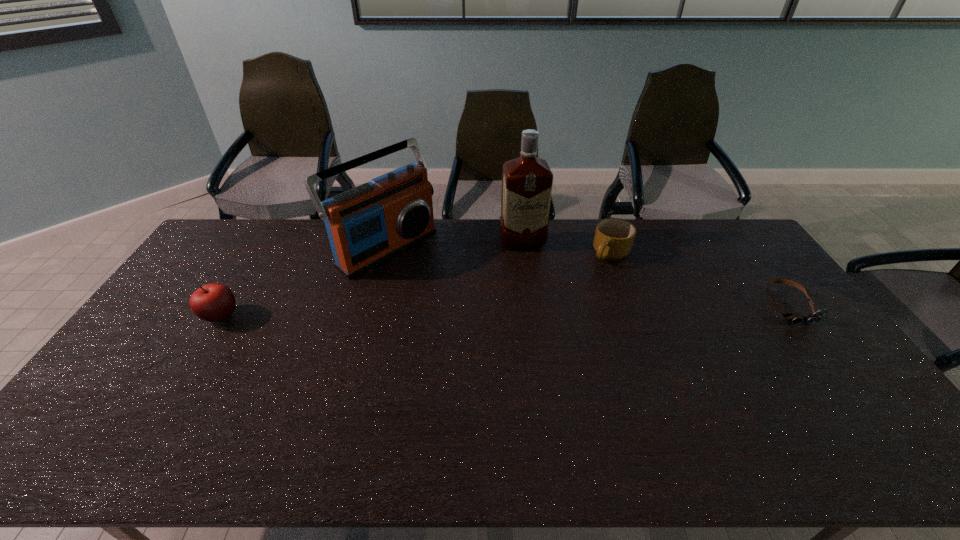
I want to click on radio receiver present at the far edge, so click(373, 222).

Identify the location of mug located in the far edge section of the desktop. coord(613,238).

At what (x,y) coordinates should I click in order to perform the action: click on liquor at the far edge. Please return your answer as a coordinate pair (x, y). Image resolution: width=960 pixels, height=540 pixels. Looking at the image, I should click on (527, 181).

Image resolution: width=960 pixels, height=540 pixels. In order to click on object at the left edge in this screenshot , I will do `click(214, 302)`.

Where is `object that is at the right edge`? This screenshot has height=540, width=960. object that is at the right edge is located at coordinates (815, 317).

Locate an element on the screen. The width and height of the screenshot is (960, 540). free region at the far edge of the desktop is located at coordinates (449, 223).

At what (x,y) coordinates should I click in order to perform the action: click on vacant region at the near edge. Please return your answer as a coordinate pair (x, y). This screenshot has height=540, width=960. Looking at the image, I should click on (636, 418).

Locate an element on the screen. The height and width of the screenshot is (540, 960). vacant area at the left edge is located at coordinates (225, 260).

Locate an element on the screen. Image resolution: width=960 pixels, height=540 pixels. vacant space at the right edge is located at coordinates (773, 324).

Image resolution: width=960 pixels, height=540 pixels. In the image, there is a desktop. What are the coordinates of `vacant space at the far left corner` in the screenshot? It's located at (242, 219).